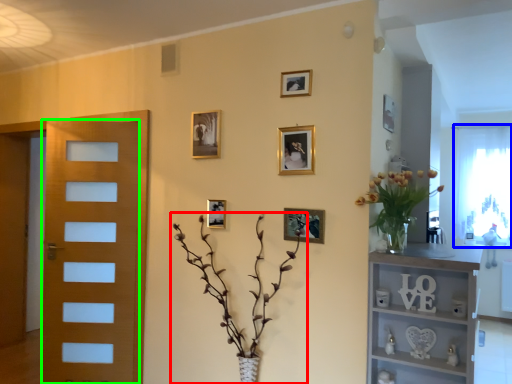
Question: Which is nearer to the houseplant (highlighted by a red box)? window screen (highlighted by a blue box) or door (highlighted by a green box).

Choices:
 (A) window screen
 (B) door

Answer: (B)